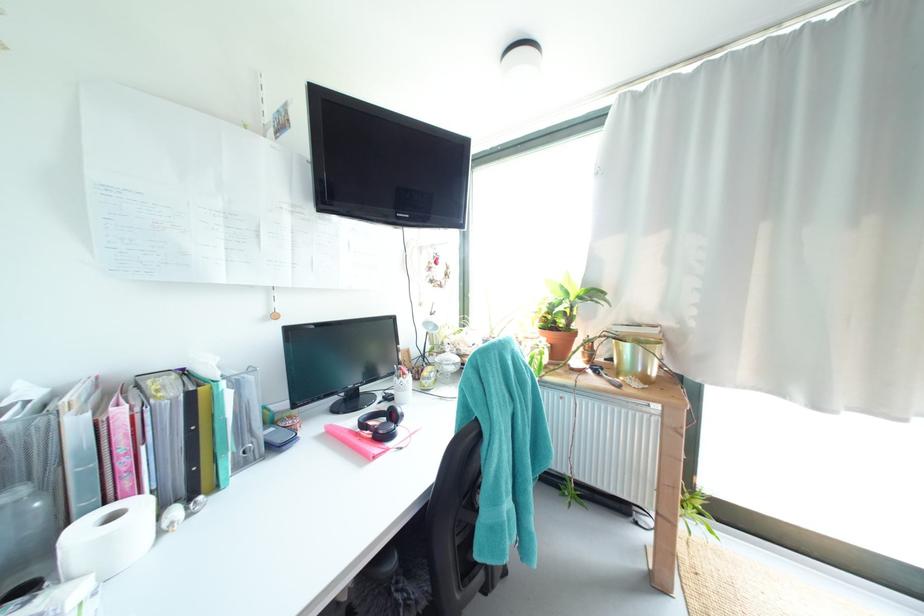
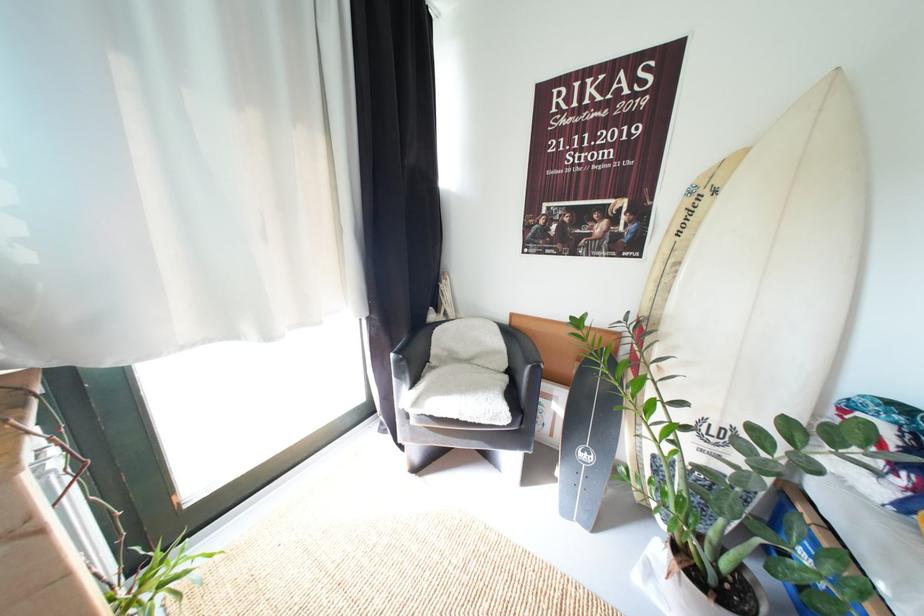
How did the camera likely rotate?

The camera's rotation is toward right-down.